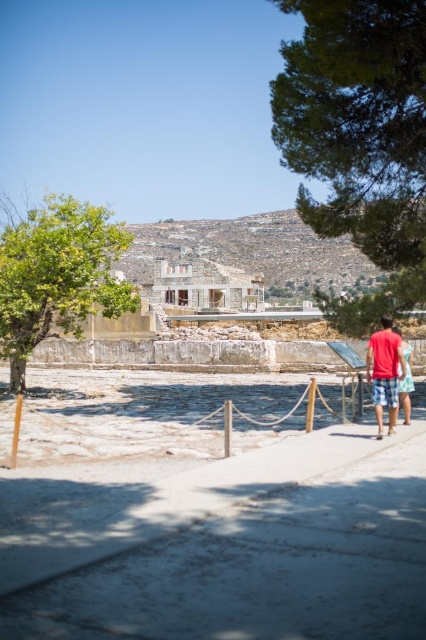
Question: Where is green leafy tree at left located in relation to red cotton shirt at right in the image?

Choices:
 (A) below
 (B) above

Answer: (B)

Question: Does green textured tree at upper right have a larger size compared to red cotton shirt at right?

Choices:
 (A) yes
 (B) no

Answer: (A)

Question: Among these objects, which one is nearest to the camera?

Choices:
 (A) green leafy tree at left
 (B) gray concrete pavement at center
 (C) light blue denim shorts at center
 (D) red cotton shirt at right

Answer: (B)

Question: Estimate the real-world distances between objects in this image. Which object is farther from the gray concrete pavement at center?

Choices:
 (A) green leafy tree at left
 (B) green textured tree at upper right

Answer: (A)

Question: Does green leafy tree at left lie behind red cotton shirt at right?

Choices:
 (A) yes
 (B) no

Answer: (A)

Question: Estimate the real-world distances between objects in this image. Which object is closer to the light blue denim shorts at center?

Choices:
 (A) green textured tree at upper right
 (B) green leafy tree at left
 (C) red cotton shirt at right
 (D) gray concrete pavement at center

Answer: (C)